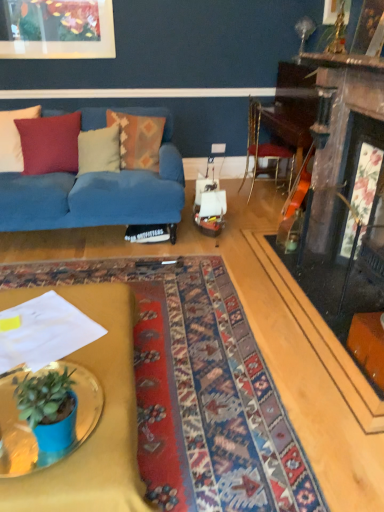
Question: Is the depth of textured woolen pillow at left, positioned as the third pillow in right-to-left order, greater than that of blue fabric couch at left?

Choices:
 (A) yes
 (B) no

Answer: (A)

Question: Is textured woolen pillow at left, the second pillow positioned from the left, bigger than blue fabric couch at left?

Choices:
 (A) yes
 (B) no

Answer: (B)

Question: Is textured woolen pillow at left, positioned as the third pillow in right-to-left order, to the right of blue fabric couch at left from the viewer's perspective?

Choices:
 (A) yes
 (B) no

Answer: (B)

Question: Is the depth of textured woolen pillow at left, positioned as the third pillow in right-to-left order, less than that of blue fabric couch at left?

Choices:
 (A) no
 (B) yes

Answer: (A)

Question: Considering the relative sizes of textured woolen pillow at left, the second pillow positioned from the left, and blue fabric couch at left in the image provided, is textured woolen pillow at left, the second pillow positioned from the left, taller than blue fabric couch at left?

Choices:
 (A) yes
 (B) no

Answer: (B)

Question: In terms of width, does metallic gold chair at center-right look wider or thinner when compared to blue fabric couch at left?

Choices:
 (A) wide
 (B) thin

Answer: (B)

Question: Do you think metallic gold chair at center-right is within blue fabric couch at left, or outside of it?

Choices:
 (A) outside
 (B) inside

Answer: (A)

Question: From the image's perspective, is metallic gold chair at center-right located above or below blue fabric couch at left?

Choices:
 (A) above
 (B) below

Answer: (A)

Question: Considering the relative positions of metallic gold chair at center-right and blue fabric couch at left in the image provided, is metallic gold chair at center-right to the left or to the right of blue fabric couch at left?

Choices:
 (A) left
 (B) right

Answer: (B)

Question: Is metallic gold desk at center to the left or to the right of metallic gold chair at center-right in the image?

Choices:
 (A) right
 (B) left

Answer: (B)

Question: Which is correct: metallic gold desk at center is inside metallic gold chair at center-right, or outside of it?

Choices:
 (A) inside
 (B) outside

Answer: (B)

Question: Looking at their shapes, would you say metallic gold desk at center is wider or thinner than metallic gold chair at center-right?

Choices:
 (A) thin
 (B) wide

Answer: (B)

Question: Does point (61, 464) appear closer or farther from the camera than point (251, 181)?

Choices:
 (A) closer
 (B) farther

Answer: (A)

Question: In the image, is blue fabric couch at left positioned in front of or behind metallic gold chair at center-right?

Choices:
 (A) front
 (B) behind

Answer: (A)

Question: From a real-world perspective, is blue fabric couch at left above or below metallic gold chair at center-right?

Choices:
 (A) above
 (B) below

Answer: (B)